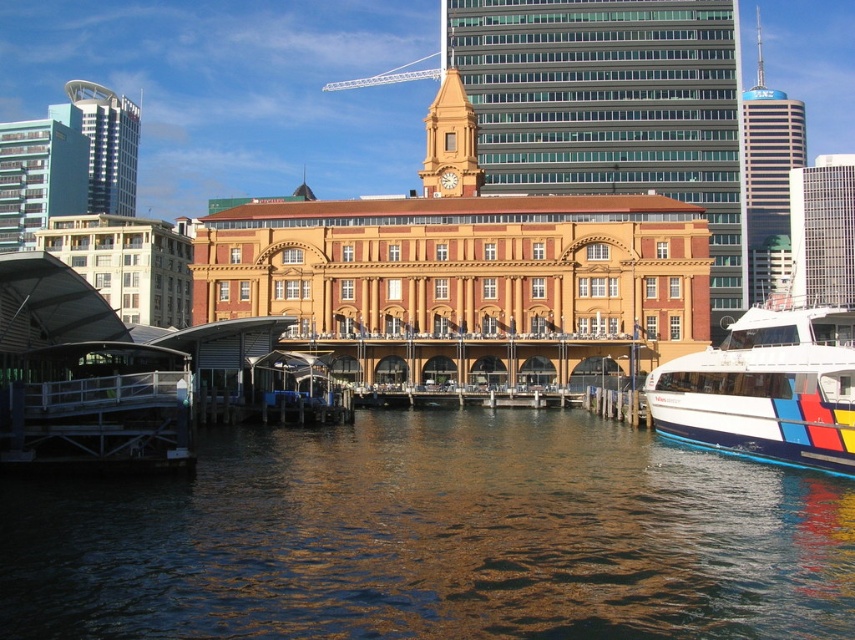
You are standing at the dock area in front of the ornate building with the clock tower. You notice a point marked at coordinates (433, 538). Based on the scene, what is the object located at this point?

The point at coordinates (433, 538) corresponds to brown reflective water at center.

You are a photographer standing at the dock and want to capture both the brown reflective water at center and the white glossy boat at lower right in the same frame. Which object should be placed closer to the camera to ensure both are in focus?

The white glossy boat at lower right should be placed closer to the camera because it is shorter than the brown reflective water at center, allowing both to be in focus when the boat is nearer.

You are standing at the waterfront and see two points marked in the image. Which point, point [622,596] or point [675,369], is closer to you?

Point [622,596] is closer to the viewer than point [675,369].